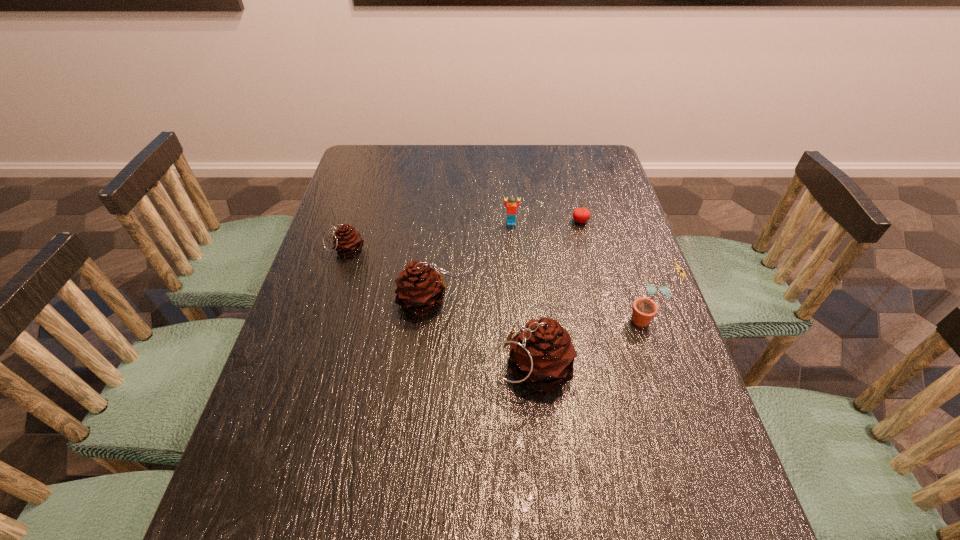
You are a GUI agent. You are given a task and a screenshot of the screen. Output one action in this format:
    pyautogui.click(x=<x>, y=<y>)
    Task: Click on the free space that satisfies the following two spatial constraints: 1. on the face of the Lego; 2. with a leaf charm attached to the second shortest pinecone
    
    Given the screenshot: What is the action you would take?
    pyautogui.click(x=517, y=302)